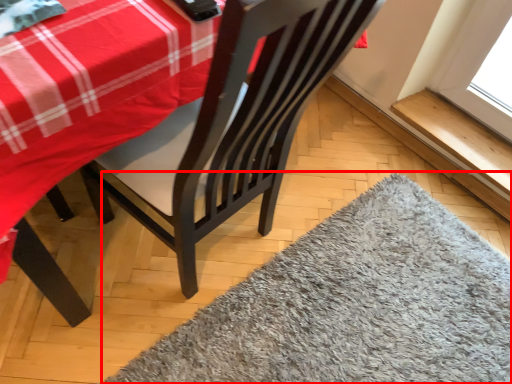
Question: From the image, what is the correct spatial relationship of mat (annotated by the red box) in relation to window sill?

Choices:
 (A) left
 (B) right

Answer: (A)